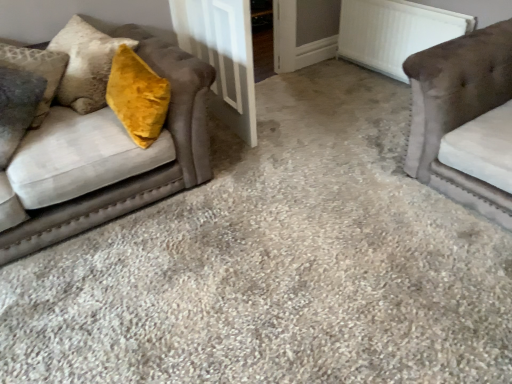
Measure the distance between point [423,74] and camera.

Point [423,74] and camera are 6.80 feet apart.

Describe the element at coordinates (459, 111) in the screenshot. The width and height of the screenshot is (512, 384). I see `suede-like beige couch at right, the second studio couch from the left` at that location.

Where is `white textured radiator at upper right`? The width and height of the screenshot is (512, 384). white textured radiator at upper right is located at coordinates (394, 32).

Does white wood door at center have a larger size compared to velvet brown couch at left, which is the 2th studio couch in right-to-left order?

No.

At what (x,y) coordinates should I click in order to perform the action: click on door located above the velvet brown couch at left, placed as the first studio couch when sorted from left to right (from a real-world perspective). Please return your answer as a coordinate pair (x, y). Looking at the image, I should click on (x=222, y=56).

Based on the photo, which is closer to the camera, [242,78] or [183,110]?

The point [183,110] is in front.

Measure the distance between white wood door at center and velvet brown couch at left, placed as the first studio couch when sorted from left to right.

white wood door at center is 26.21 inches away from velvet brown couch at left, placed as the first studio couch when sorted from left to right.

Which of these two, suede-like beige couch at right, which is counted as the 1th studio couch, starting from the right, or white textured radiator at upper right, is wider?

suede-like beige couch at right, which is counted as the 1th studio couch, starting from the right, is wider.

Is suede-like beige couch at right, which is counted as the 1th studio couch, starting from the right, shorter than white textured radiator at upper right?

Incorrect, the height of suede-like beige couch at right, which is counted as the 1th studio couch, starting from the right, does not fall short of that of white textured radiator at upper right.

From a real-world perspective, is suede-like beige couch at right, which is counted as the 1th studio couch, starting from the right, beneath white textured radiator at upper right?

No.

In the scene shown: How far apart are suede-like beige couch at right, which is counted as the 1th studio couch, starting from the right, and white textured radiator at upper right?

suede-like beige couch at right, which is counted as the 1th studio couch, starting from the right, is 38.28 inches from white textured radiator at upper right.

Find the location of `the 2nd studio couch in front of the white wood door at center, starting your count from the anchor`. the 2nd studio couch in front of the white wood door at center, starting your count from the anchor is located at coordinates (459, 111).

Does suede-like beige couch at right, which is counted as the 1th studio couch, starting from the right, have a greater width compared to white wood door at center?

Yes, suede-like beige couch at right, which is counted as the 1th studio couch, starting from the right, is wider than white wood door at center.

From the picture: Is the position of suede-like beige couch at right, the second studio couch from the left, more distant than that of white wood door at center?

No, suede-like beige couch at right, the second studio couch from the left, is closer to the viewer.

Can you confirm if suede-like beige couch at right, which is counted as the 1th studio couch, starting from the right, is positioned to the left of white wood door at center?

No, suede-like beige couch at right, which is counted as the 1th studio couch, starting from the right, is not to the left of white wood door at center.

From a real-world perspective, is velvet brown couch at left, which is the 2th studio couch in right-to-left order, positioned over white wood door at center based on gravity?

No, from a real-world perspective, velvet brown couch at left, which is the 2th studio couch in right-to-left order, is not above white wood door at center.

In terms of height, does velvet brown couch at left, which is the 2th studio couch in right-to-left order, look taller or shorter compared to white wood door at center?

In the image, velvet brown couch at left, which is the 2th studio couch in right-to-left order, appears to be shorter than white wood door at center.

Considering the sizes of objects velvet brown couch at left, which is the 2th studio couch in right-to-left order, and white wood door at center in the image provided, who is smaller, velvet brown couch at left, which is the 2th studio couch in right-to-left order, or white wood door at center?

white wood door at center.

Considering the positions of point (152, 41) and point (244, 120), is point (152, 41) closer or farther from the camera than point (244, 120)?

Point (152, 41) appears to be closer to the viewer than point (244, 120).

In the image, is white textured radiator at upper right on the left side or the right side of velvet brown couch at left, placed as the first studio couch when sorted from left to right?

Clearly, white textured radiator at upper right is on the right of velvet brown couch at left, placed as the first studio couch when sorted from left to right, in the image.

Does white textured radiator at upper right turn towards velvet brown couch at left, placed as the first studio couch when sorted from left to right?

Yes, white textured radiator at upper right is turned towards velvet brown couch at left, placed as the first studio couch when sorted from left to right.

Considering the positions of point (375, 60) and point (13, 245), is point (375, 60) closer or farther from the camera than point (13, 245)?

Point (375, 60) is farther from the camera than point (13, 245).

Are suede-like beige couch at right, the second studio couch from the left, and velvet brown couch at left, placed as the first studio couch when sorted from left to right, making contact?

suede-like beige couch at right, the second studio couch from the left, and velvet brown couch at left, placed as the first studio couch when sorted from left to right, are not in contact.

Is suede-like beige couch at right, which is counted as the 1th studio couch, starting from the right, smaller than velvet brown couch at left, which is the 2th studio couch in right-to-left order?

Indeed, suede-like beige couch at right, which is counted as the 1th studio couch, starting from the right, has a smaller size compared to velvet brown couch at left, which is the 2th studio couch in right-to-left order.

Can white textured radiator at upper right be found inside velvet brown couch at left, which is the 2th studio couch in right-to-left order?

No, white textured radiator at upper right is not inside velvet brown couch at left, which is the 2th studio couch in right-to-left order.

Is velvet brown couch at left, placed as the first studio couch when sorted from left to right, positioned far away from white textured radiator at upper right?

Yes, velvet brown couch at left, placed as the first studio couch when sorted from left to right, and white textured radiator at upper right are located far from each other.

Does velvet brown couch at left, placed as the first studio couch when sorted from left to right, come behind white textured radiator at upper right?

No, the depth of velvet brown couch at left, placed as the first studio couch when sorted from left to right, is less than that of white textured radiator at upper right.

From the image's perspective, is velvet brown couch at left, which is the 2th studio couch in right-to-left order, located beneath white textured radiator at upper right?

Yes.

The height and width of the screenshot is (384, 512). What are the coordinates of `door that appears above the velvet brown couch at left, placed as the first studio couch when sorted from left to right (from the image's perspective)` in the screenshot? It's located at (222, 56).

I want to click on studio couch that is the 2nd object above the white textured radiator at upper right (from a real-world perspective), so [459, 111].

Based on their spatial positions, is white wood door at center or suede-like beige couch at right, which is counted as the 1th studio couch, starting from the right, closer to white textured radiator at upper right?

suede-like beige couch at right, which is counted as the 1th studio couch, starting from the right.

From the image, which object appears to be nearer to white wood door at center, white textured radiator at upper right or velvet brown couch at left, which is the 2th studio couch in right-to-left order?

The object closer to white wood door at center is velvet brown couch at left, which is the 2th studio couch in right-to-left order.

Estimate the real-world distances between objects in this image. Which object is further from velvet brown couch at left, placed as the first studio couch when sorted from left to right, white wood door at center or suede-like beige couch at right, the second studio couch from the left?

suede-like beige couch at right, the second studio couch from the left, is further to velvet brown couch at left, placed as the first studio couch when sorted from left to right.

When comparing their distances from suede-like beige couch at right, which is counted as the 1th studio couch, starting from the right, does white textured radiator at upper right or velvet brown couch at left, which is the 2th studio couch in right-to-left order, seem closer?

white textured radiator at upper right is closer to suede-like beige couch at right, which is counted as the 1th studio couch, starting from the right.

Based on their spatial positions, is velvet brown couch at left, placed as the first studio couch when sorted from left to right, or white wood door at center further from white textured radiator at upper right?

velvet brown couch at left, placed as the first studio couch when sorted from left to right, is positioned further to the anchor white textured radiator at upper right.

Considering their positions, is velvet brown couch at left, which is the 2th studio couch in right-to-left order, positioned closer to white wood door at center than white textured radiator at upper right?

velvet brown couch at left, which is the 2th studio couch in right-to-left order.

Looking at the image, which one is located closer to velvet brown couch at left, which is the 2th studio couch in right-to-left order, white textured radiator at upper right or suede-like beige couch at right, which is counted as the 1th studio couch, starting from the right?

suede-like beige couch at right, which is counted as the 1th studio couch, starting from the right.

Considering their positions, is white wood door at center positioned further to white textured radiator at upper right than velvet brown couch at left, placed as the first studio couch when sorted from left to right?

velvet brown couch at left, placed as the first studio couch when sorted from left to right.

Where is `radiator situated between velvet brown couch at left, placed as the first studio couch when sorted from left to right, and suede-like beige couch at right, the second studio couch from the left, from left to right`? This screenshot has width=512, height=384. radiator situated between velvet brown couch at left, placed as the first studio couch when sorted from left to right, and suede-like beige couch at right, the second studio couch from the left, from left to right is located at coordinates (394, 32).

Where is `radiator located between white wood door at center and suede-like beige couch at right, which is counted as the 1th studio couch, starting from the right, in the left-right direction`? radiator located between white wood door at center and suede-like beige couch at right, which is counted as the 1th studio couch, starting from the right, in the left-right direction is located at coordinates (394, 32).

Identify the location of door between velvet brown couch at left, placed as the first studio couch when sorted from left to right, and white textured radiator at upper right. (222, 56).

Image resolution: width=512 pixels, height=384 pixels. Find the location of `door between velvet brown couch at left, placed as the first studio couch when sorted from left to right, and suede-like beige couch at right, the second studio couch from the left`. door between velvet brown couch at left, placed as the first studio couch when sorted from left to right, and suede-like beige couch at right, the second studio couch from the left is located at coordinates (222, 56).